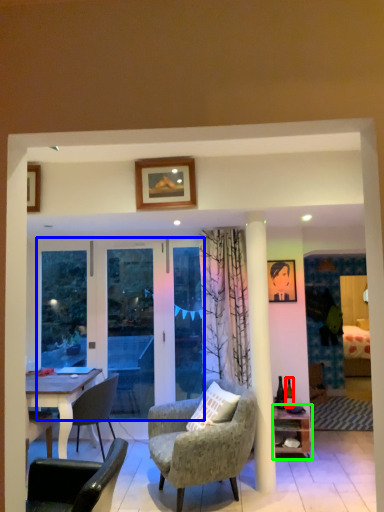
Question: Considering the real-world distances, which object is closest to bottle (highlighted by a red box)? screen door (highlighted by a blue box) or shelf (highlighted by a green box).

Choices:
 (A) screen door
 (B) shelf

Answer: (B)